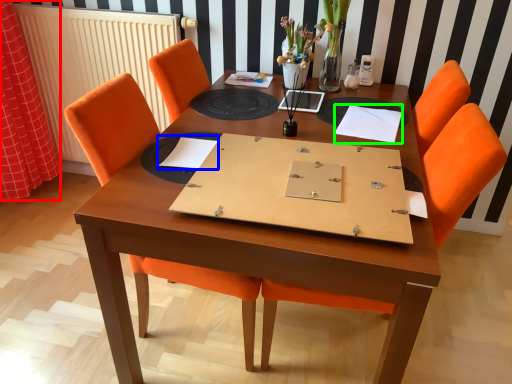
Question: Considering the real-world distances, which object is farthest from curtain (highlighted by a red box)? notebook (highlighted by a blue box) or notebook (highlighted by a green box)?

Choices:
 (A) notebook
 (B) notebook

Answer: (B)